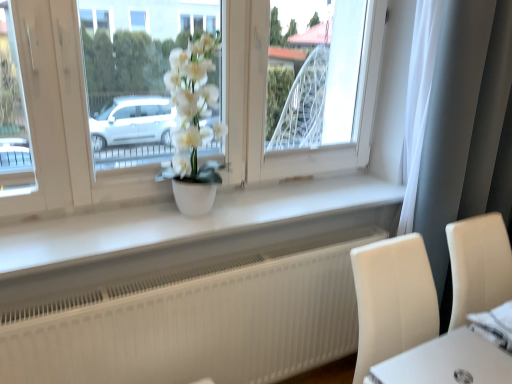
At what (x,y) coordinates should I click in order to perform the action: click on vacant space in between white matte pot at center and white matte flower pot at center. Please return your answer as a coordinate pair (x, y). The width and height of the screenshot is (512, 384). Looking at the image, I should click on (225, 205).